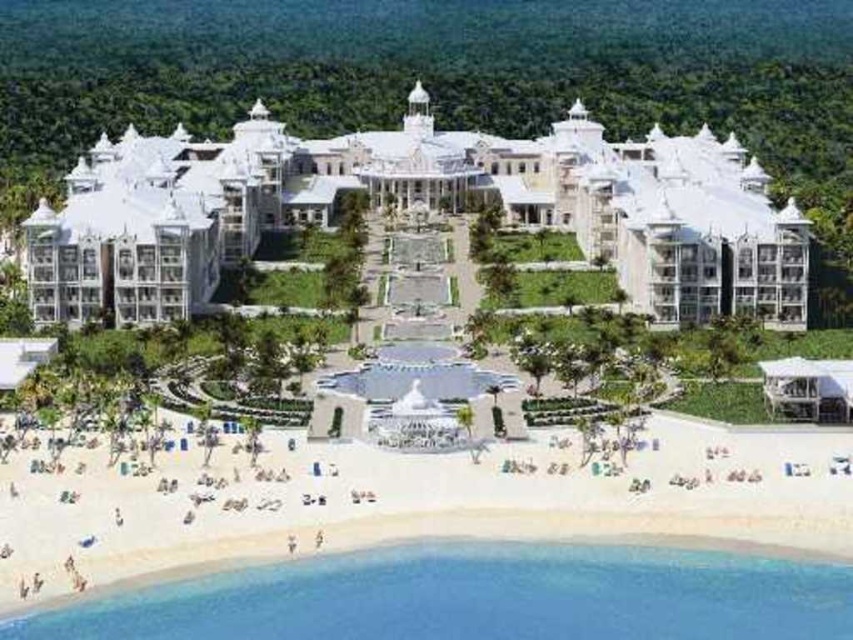
You are a guest staying at the resort and want to take a walk along the beach. From your current position at the white glossy resort at center, in which direction should you head to reach the white sand beach at lower left?

Since the white glossy resort at center is positioned on the left side of white sand beach at lower left, you should head to the right to reach the white sand beach at lower left.

You are planning to take a photo of the white glossy resort at center and the white sand beach at lower left. Which object should you focus on first if you want to include both in your frame without zooming in or out?

The white glossy resort at center should be focused on first because it has a larger size compared to the white sand beach at lower left, so it will occupy more space in the frame and ensure both are visible without needing to adjust the zoom.

You are a resort guest standing at the entrance of the resort. You want to walk to the beach. Which direction should you go relative to the white glossy resort at center and the white sand beach at lower left?

The white sand beach at lower left is located to the lower left of the white glossy resort at center, so you should walk towards the lower left direction from the white glossy resort at center to reach the beach.